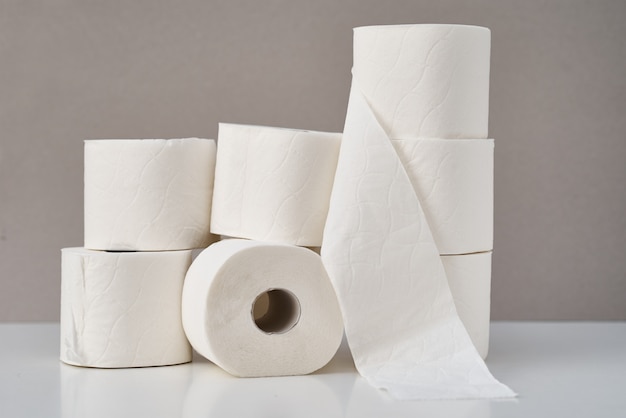
Where is `toilet paper rolls`? toilet paper rolls is located at coordinates (446, 81), (434, 218), (459, 303), (292, 198), (275, 270), (175, 214), (156, 295).